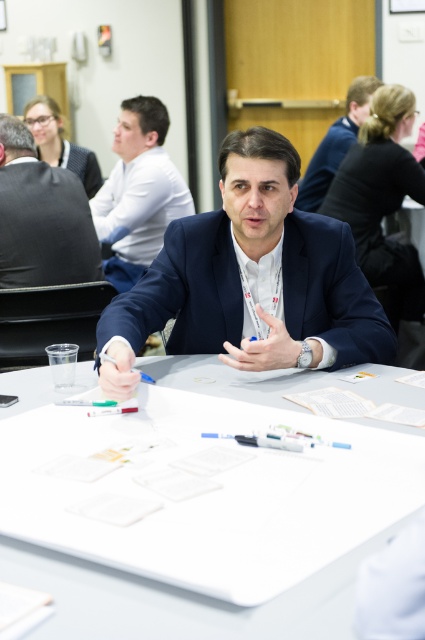
You are standing at the entrance of the room and want to approach the dark gray suit at upper left. Which direction should you move to reach it?

The dark gray suit at upper left is located at the upper left part of the scene, so you should move towards the upper left direction to reach it.